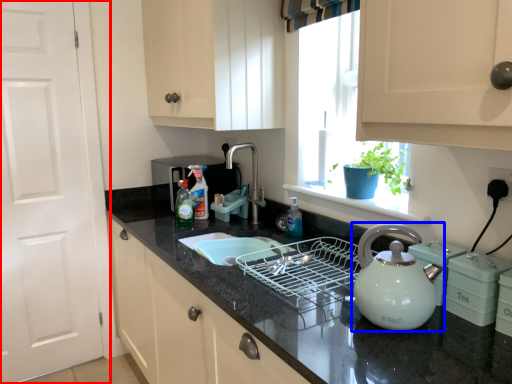
Question: Which of the following is the closest to the observer, door (highlighted by a red box) or kettle (highlighted by a blue box)?

Choices:
 (A) door
 (B) kettle

Answer: (B)